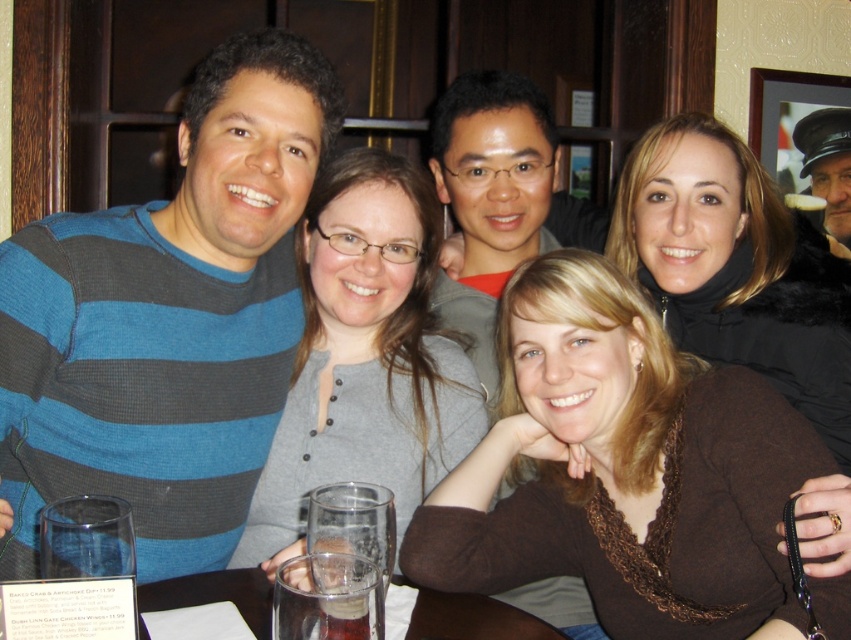
You are a server at the restaurant. You need to deliver a dessert to the table where the brown textured sweater at center and the clear glass at table center are present. Where should you place the dessert relative to these items?

The dessert should be placed above the clear glass at table center since the brown textured sweater at center is already located above it, and the server should avoid placing it directly under the sweater to prevent spills or obstruction.

From the picture: You are a server at the restaurant and need to determine which glass to refill. The taller glass is preferred by the customer. Which glass should you choose between the clear glass water at lower center and the clear glass at table center?

The clear glass at table center is taller than the clear glass water at lower center, so you should refill the clear glass at table center.

You are a waiter at the restaurant. You need to deliver a dessert to the table where the clear glass water at lower center and the clear glass at table center are located. Which glass should you place the dessert next to, considering the spatial arrangement?

The clear glass at table center is behind the clear glass water at lower center, so you should place the dessert next to the clear glass water at lower center since it is in front and more accessible.